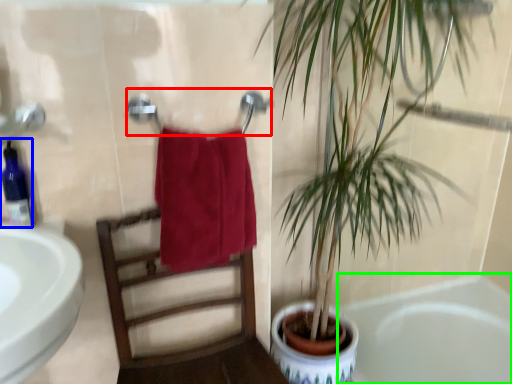
Question: Which object is the closest to the towel bar (highlighted by a red box)? Choose among these: soap dispenser (highlighted by a blue box) or bathtub (highlighted by a green box).

Choices:
 (A) soap dispenser
 (B) bathtub

Answer: (A)